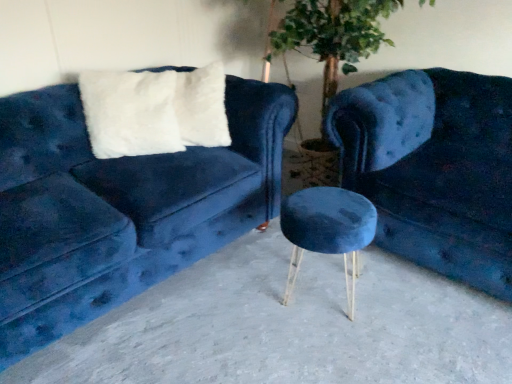
Question: Is velvet blue couch at center, the first studio couch viewed from the right, closer to camera compared to velvet blue stool at center?

Choices:
 (A) yes
 (B) no

Answer: (A)

Question: Are velvet blue couch at center, the first studio couch viewed from the right, and velvet blue stool at center making contact?

Choices:
 (A) yes
 (B) no

Answer: (B)

Question: Considering the relative sizes of velvet blue couch at center, placed as the second studio couch when sorted from left to right, and velvet blue stool at center in the image provided, is velvet blue couch at center, placed as the second studio couch when sorted from left to right, thinner than velvet blue stool at center?

Choices:
 (A) no
 (B) yes

Answer: (A)

Question: Can you confirm if velvet blue couch at center, placed as the second studio couch when sorted from left to right, is bigger than velvet blue stool at center?

Choices:
 (A) yes
 (B) no

Answer: (A)

Question: From the image's perspective, is velvet blue couch at center, placed as the second studio couch when sorted from left to right, on velvet blue stool at center?

Choices:
 (A) no
 (B) yes

Answer: (B)

Question: Considering the positions of point (68, 240) and point (287, 365), is point (68, 240) closer or farther from the camera than point (287, 365)?

Choices:
 (A) farther
 (B) closer

Answer: (B)

Question: Is velvet blue couch at left, marked as the 2th studio couch in a right-to-left arrangement, wider or thinner than smooth concrete stool at center?

Choices:
 (A) wide
 (B) thin

Answer: (B)

Question: Is velvet blue couch at left, marked as the 2th studio couch in a right-to-left arrangement, taller or shorter than smooth concrete stool at center?

Choices:
 (A) tall
 (B) short

Answer: (A)

Question: Is velvet blue couch at left, which is counted as the 1th studio couch, starting from the left, situated inside smooth concrete stool at center or outside?

Choices:
 (A) outside
 (B) inside

Answer: (A)

Question: From a real-world perspective, relative to velvet blue couch at center, placed as the second studio couch when sorted from left to right, is smooth concrete stool at center vertically above or below?

Choices:
 (A) below
 (B) above

Answer: (A)

Question: Is point 315,312 positioned closer to the camera than point 453,84?

Choices:
 (A) farther
 (B) closer

Answer: (B)

Question: Considering the positions of smooth concrete stool at center and velvet blue couch at center, the first studio couch viewed from the right, in the image, is smooth concrete stool at center taller or shorter than velvet blue couch at center, the first studio couch viewed from the right,?

Choices:
 (A) tall
 (B) short

Answer: (B)

Question: In the image, is smooth concrete stool at center on the left side or the right side of velvet blue couch at center, placed as the second studio couch when sorted from left to right?

Choices:
 (A) right
 (B) left

Answer: (B)

Question: Considering their positions, is velvet blue stool at center located in front of or behind smooth concrete stool at center?

Choices:
 (A) behind
 (B) front

Answer: (A)

Question: Is point (352, 218) positioned closer to the camera than point (457, 286)?

Choices:
 (A) closer
 (B) farther

Answer: (A)